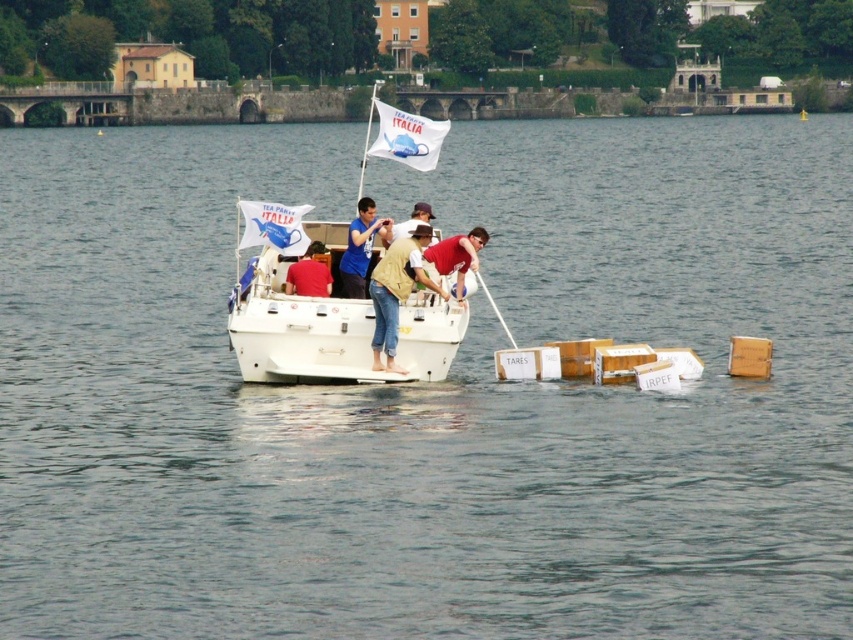
Question: In this image, where is white matte boat at center located relative to matte red shirt at center?

Choices:
 (A) left
 (B) right

Answer: (A)

Question: Which of the following is the closest to the observer?

Choices:
 (A) (422, 120)
 (B) (310, 252)
 (C) (422, 214)

Answer: (B)

Question: Is white matte boat at center smaller than blue fabric shirt at center?

Choices:
 (A) yes
 (B) no

Answer: (A)

Question: Which of the following is the farthest from the observer?

Choices:
 (A) denim jeans at center
 (B) white matte boat at center
 (C) white fabric flag at upper center

Answer: (C)

Question: Which of the following is the closest to the observer?

Choices:
 (A) (305, 257)
 (B) (395, 109)
 (C) (384, 241)

Answer: (C)

Question: Does denim jeans at center appear over matte yellow shirt at center?

Choices:
 (A) yes
 (B) no

Answer: (B)